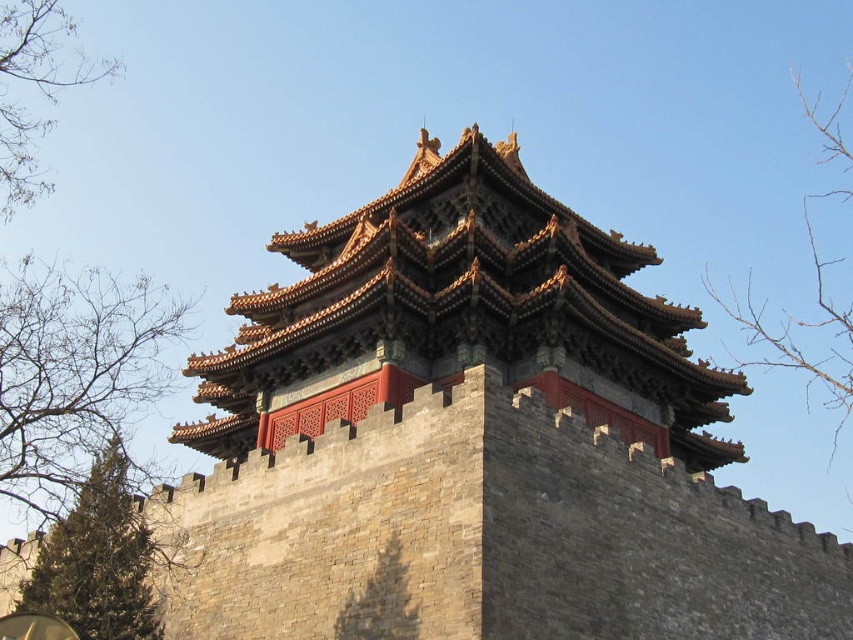
You are a bird flying over the corner tower. You see the bare branches at left and the bare branches at upper right. Which branches are closer to you?

The bare branches at left are closer to you because they are in front of the bare branches at upper right.

You are an architect examining the traditional Chinese tower and its surroundings. You notice two sets of bare branches in the scene. Which set, the bare branches at left or the bare branches at upper right, extends higher into the sky?

The bare branches at upper right extends higher into the sky than the bare branches at left.

You are standing at the corner tower of the Forbidden City and notice a point marked at coordinates (99, 561). What object is this point located on?

The point at (99, 561) is located on the green textured tree at lower left.